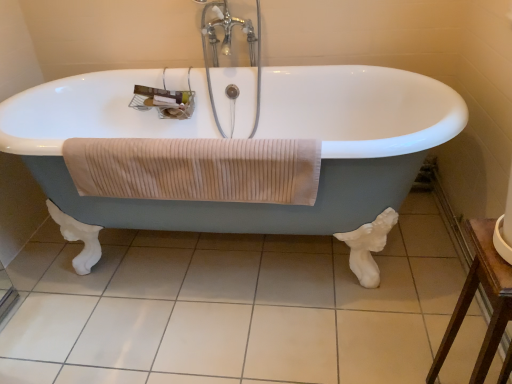
At what (x,y) coordinates should I click in order to perform the action: click on vacant space situated above beige ribbed towel at center (from a real-world perspective). Please return your answer as a coordinate pair (x, y). Looking at the image, I should click on (165, 143).